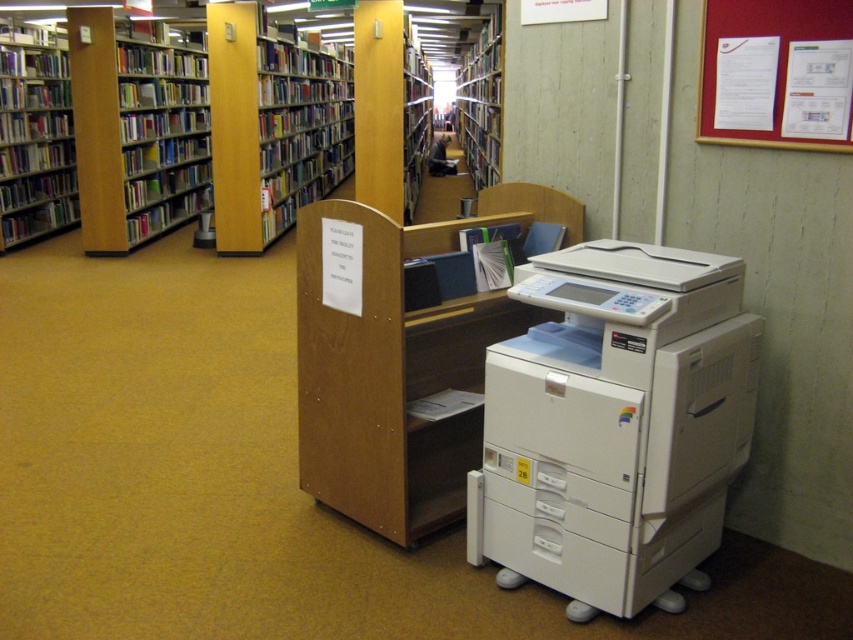
You are a student who needs to print a document and then find a book. You see the white plastic printer at lower right and the wooden bookcase at center. Which object should you approach first to print your document?

You should approach the white plastic printer at lower right first to print your document because it is located to the left of the wooden bookcase at center, making it closer to your current position.

You are standing in the library and need to determine the relative positions of the white plastic printer at lower right and the wooden bookcase at left. Which object is nearer to you?

The white plastic printer at lower right is closer to the viewer than the wooden bookcase at left.